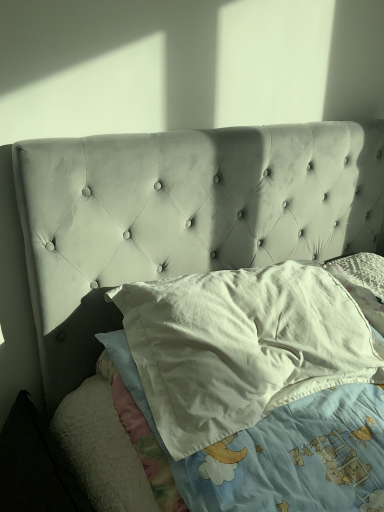
This screenshot has height=512, width=384. What do you see at coordinates (246, 345) in the screenshot?
I see `white cotton pillow at center` at bounding box center [246, 345].

Find the location of `white cotton pillow at center`. white cotton pillow at center is located at coordinates (246, 345).

The image size is (384, 512). I want to click on white cotton pillow at center, so click(x=246, y=345).